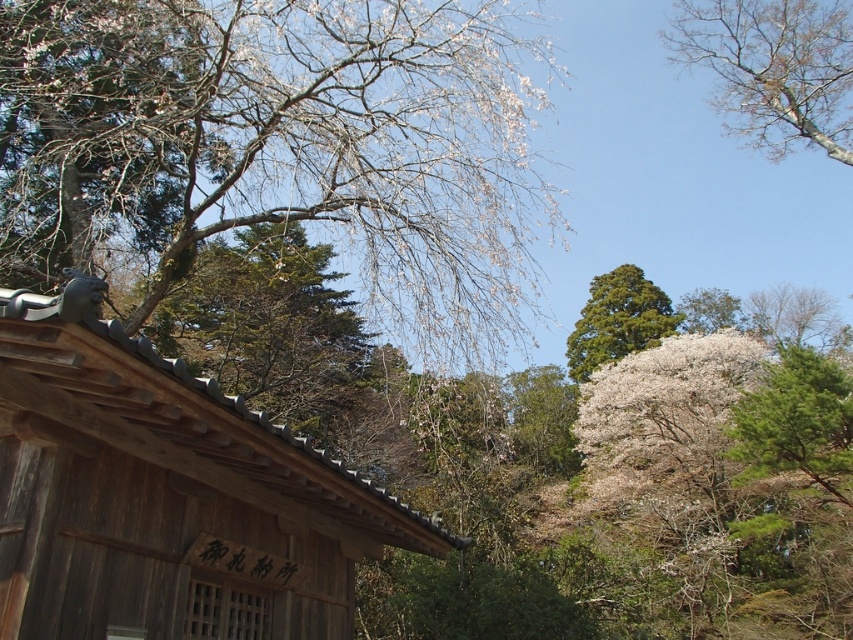
Is wooden hut at left wider than bare branches at upper right?

No.

Can you confirm if wooden hut at left is positioned above bare branches at upper right?

No.

Which is in front, point (286, 627) or point (799, 125)?

Point (286, 627)

The width and height of the screenshot is (853, 640). Find the location of `wooden hut at left`. wooden hut at left is located at coordinates (166, 493).

Is point (479, 152) farther from camera compared to point (338, 518)?

Yes, it is behind point (338, 518).

Find the location of a particular element. This screenshot has width=853, height=640. white blossoms at upper left is located at coordinates (277, 148).

Is white blossoms at upper left further to the viewer compared to bare branches at upper right?

That is False.

Is point (282, 90) positioned in front of point (749, 116)?

Yes.

Where is `white blossoms at upper left`? This screenshot has height=640, width=853. white blossoms at upper left is located at coordinates (277, 148).